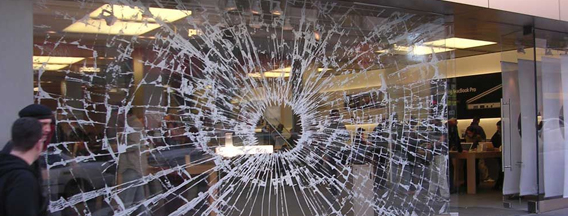
You are a GUI agent. You are given a task and a screenshot of the screen. Output one action in this format:
    pyautogui.click(x=<x>, y=<y>)
    Task: Click on the table of laptops
    Image resolution: width=568 pixels, height=216 pixels.
    Given the screenshot: What is the action you would take?
    pyautogui.click(x=471, y=152)